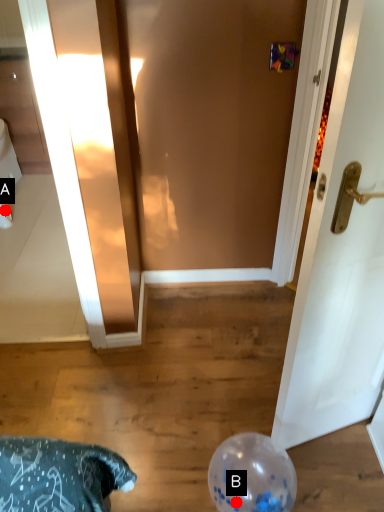
Question: Two points are circled on the image, labeled by A and B beside each circle. Among these points, which one is farthest from the camera?

Choices:
 (A) A is further
 (B) B is further

Answer: (A)